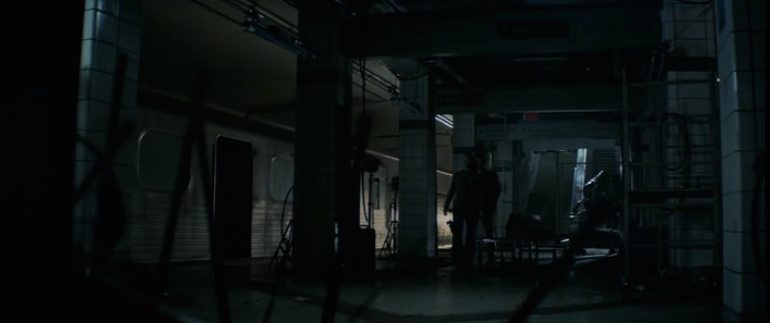
Identify the location of column or support beam. The height and width of the screenshot is (323, 770). 419,179, 330,166.